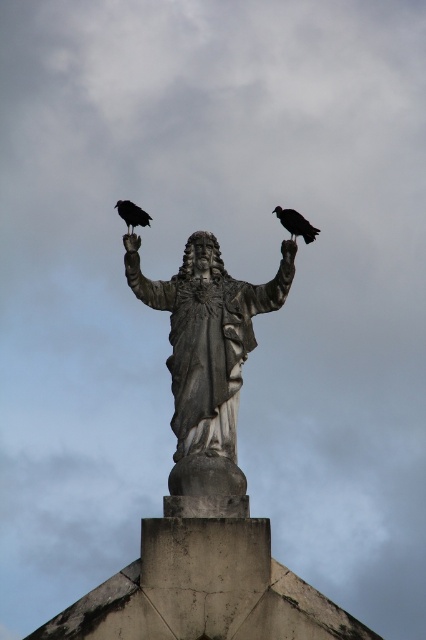
Measure the distance between point (147, 298) and camera.

They are 419.27 feet apart.

Is gray stone statue at center wider than black matte raven at upper right?

Indeed, gray stone statue at center has a greater width compared to black matte raven at upper right.

Locate an element on the screen. gray stone statue at center is located at coordinates (207, 355).

Who is shorter, black matte raven at upper right or black matte raven at upper left?

With less height is black matte raven at upper left.

Is black matte raven at upper right wider than black matte raven at upper left?

Yes, black matte raven at upper right is wider than black matte raven at upper left.

Where is `black matte raven at upper right`? This screenshot has height=640, width=426. black matte raven at upper right is located at coordinates (296, 224).

Identify the location of black matte raven at upper right. (296, 224).

Is gray stone statue at center wider than black matte raven at upper left?

Yes, gray stone statue at center is wider than black matte raven at upper left.

Can you confirm if gray stone statue at center is smaller than black matte raven at upper left?

Actually, gray stone statue at center might be larger than black matte raven at upper left.

Which is behind, point (192, 360) or point (123, 220)?

The point (123, 220) is behind.

Image resolution: width=426 pixels, height=640 pixels. What are the coordinates of `gray stone statue at center` in the screenshot? It's located at (207, 355).